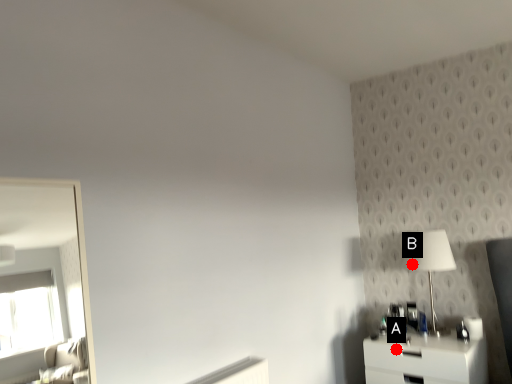
Question: Two points are circled on the image, labeled by A and B beside each circle. Which point appears closest to the camera in this image?

Choices:
 (A) A is closer
 (B) B is closer

Answer: (A)